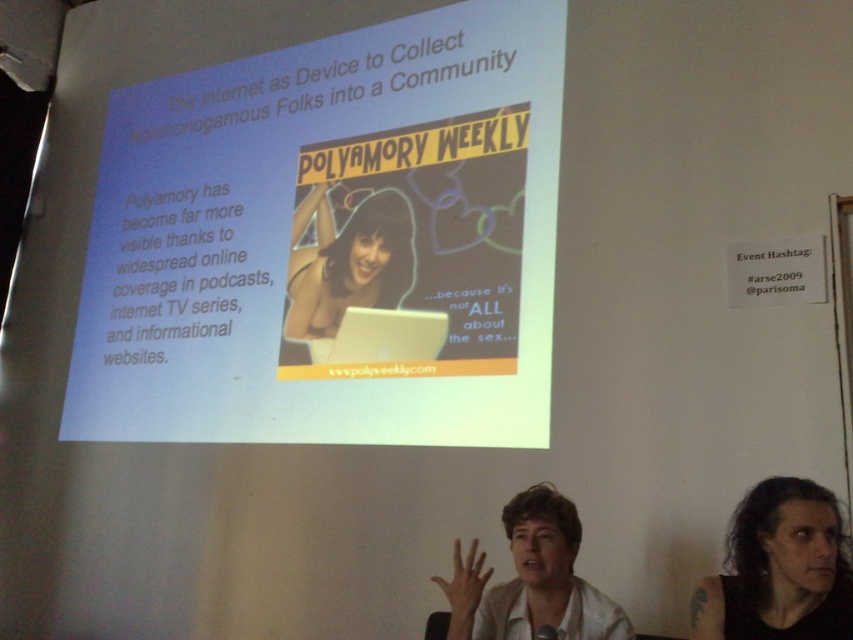
You are a photographer standing at the back of the conference room. You want to take a photo of the dark brown hair at lower right and the camera. Can you fit both in your camera frame if your camera has a minimum distance of 1.8 meters between subjects to capture them clearly?

The dark brown hair at lower right and camera are 1.86 meters apart from each other, so yes, the photographer can capture both clearly in the camera frame since the distance between them is greater than the minimum required 1.8 meters.

What is the relationship between the height of the dark brown hair at lower right and the white matte shirt at center in the image?

The dark brown hair at lower right is taller than the white matte shirt at center.